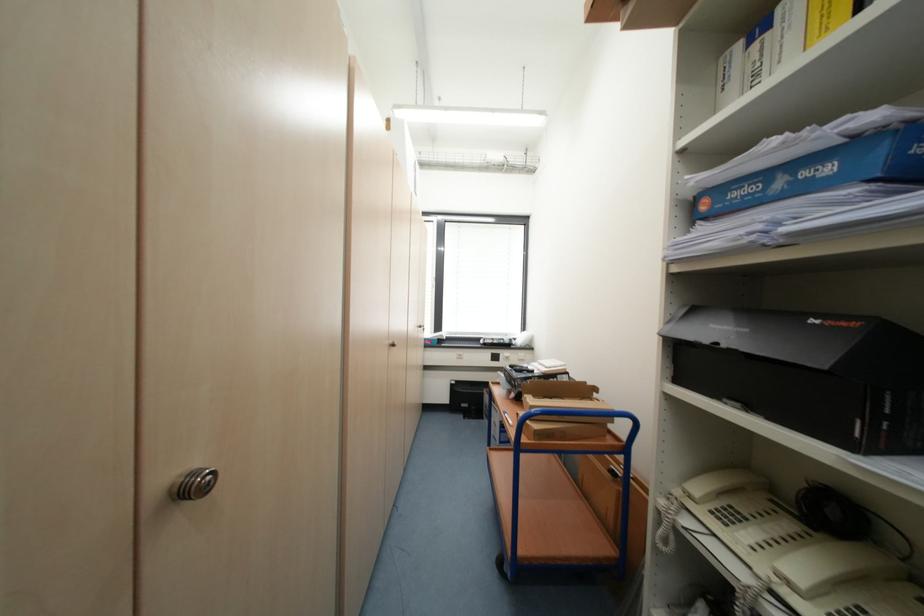
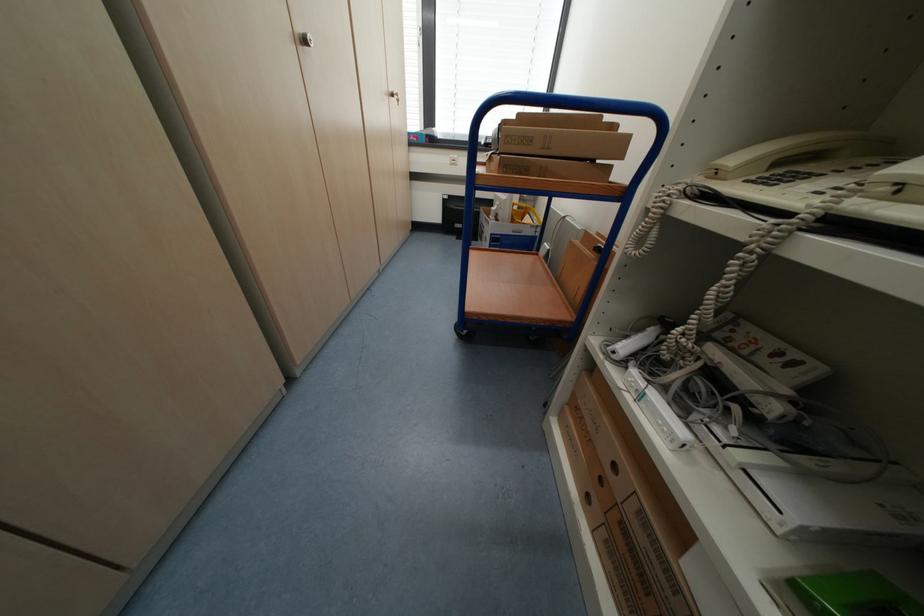
Question: The first image is from the beginning of the video and the second image is from the end. How did the camera likely rotate when shooting the video?

Choices:
 (A) Left
 (B) Right
 (C) Up
 (D) Down

Answer: (D)